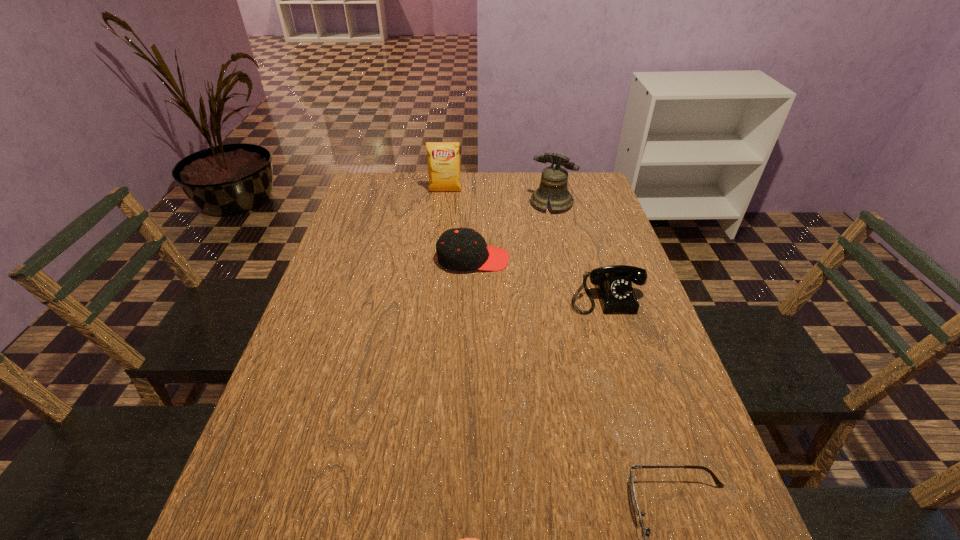
Identify the location of bell that is at the right edge. (554, 178).

The width and height of the screenshot is (960, 540). Find the location of `telephone situated at the right edge`. telephone situated at the right edge is located at coordinates (613, 283).

Locate an element on the screen. This screenshot has width=960, height=540. object at the far right corner is located at coordinates (554, 178).

In the image, there is a desktop. Where is `vacant area at the far edge`? This screenshot has width=960, height=540. vacant area at the far edge is located at coordinates (413, 202).

I want to click on vacant space at the left edge of the desktop, so click(295, 475).

This screenshot has width=960, height=540. In order to click on vacant space at the right edge in this screenshot , I will do `click(666, 414)`.

The height and width of the screenshot is (540, 960). I want to click on vacant area at the far left corner of the desktop, so click(x=389, y=191).

Image resolution: width=960 pixels, height=540 pixels. Identify the location of free space that is in between the bell and the crisp (potato chip). (498, 198).

Identify the location of free space that is in between the cap and the bell. (512, 231).

This screenshot has height=540, width=960. Identify the location of free spot between the crisp (potato chip) and the bell. (498, 198).